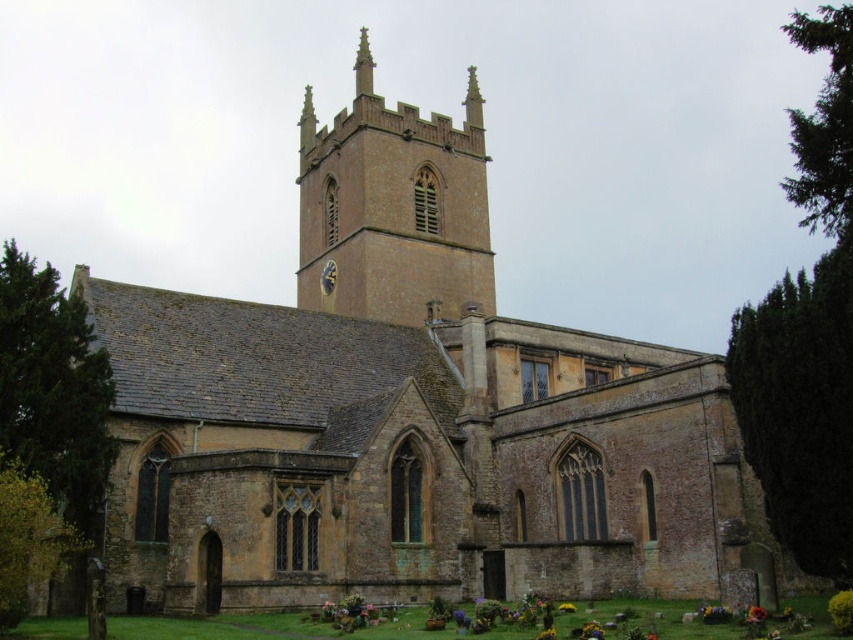
You are standing in front of the church and want to place a small statue of a bird on the tallest object visible in the scene. Which object should you choose between the smooth stone spire at upper center and the vibrant yellow petals at lower center?

The smooth stone spire at upper center is taller than the vibrant yellow petals at lower center, so you should place the bird statue on the smooth stone spire at upper center.

You are an architect designing a model of the church. You need to ensure that the smooth stone spire at upper center and the vibrant yellow petals at lower center are scaled correctly. Which object should have a wider base in the model?

The smooth stone spire at upper center should have a wider base in the model because its width is larger than the vibrant yellow petals at lower center.